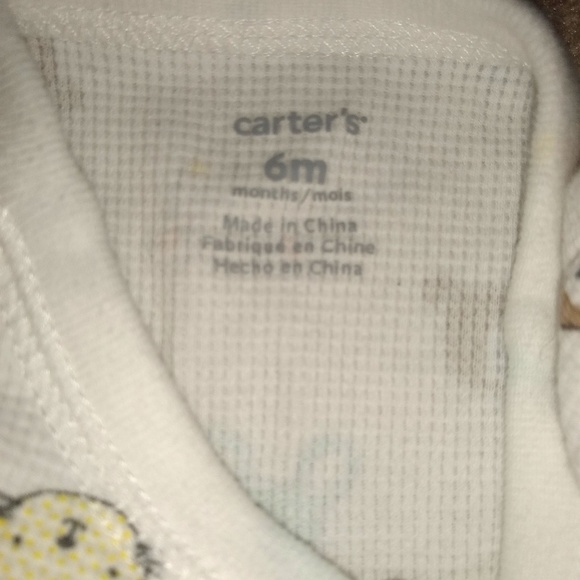
What are the coordinates of `textile` in the screenshot? It's located at (427, 195).